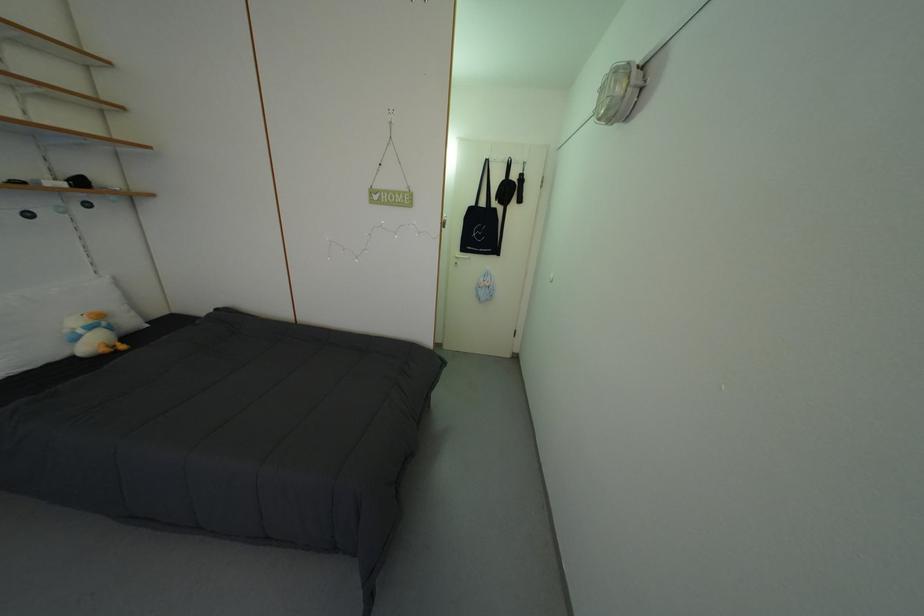
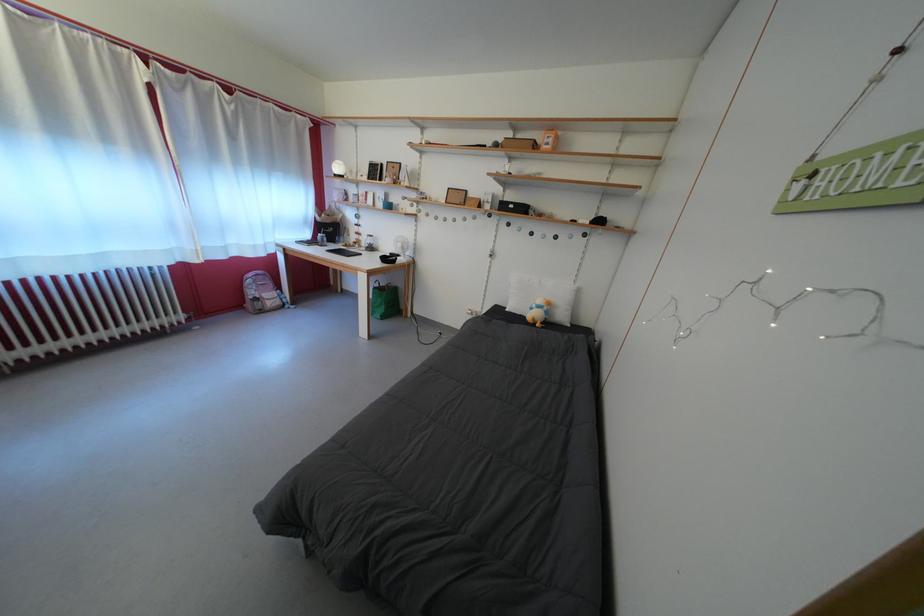
Locate, in the second image, the point that corresponds to the point at 90,338 in the first image.

(542, 312)